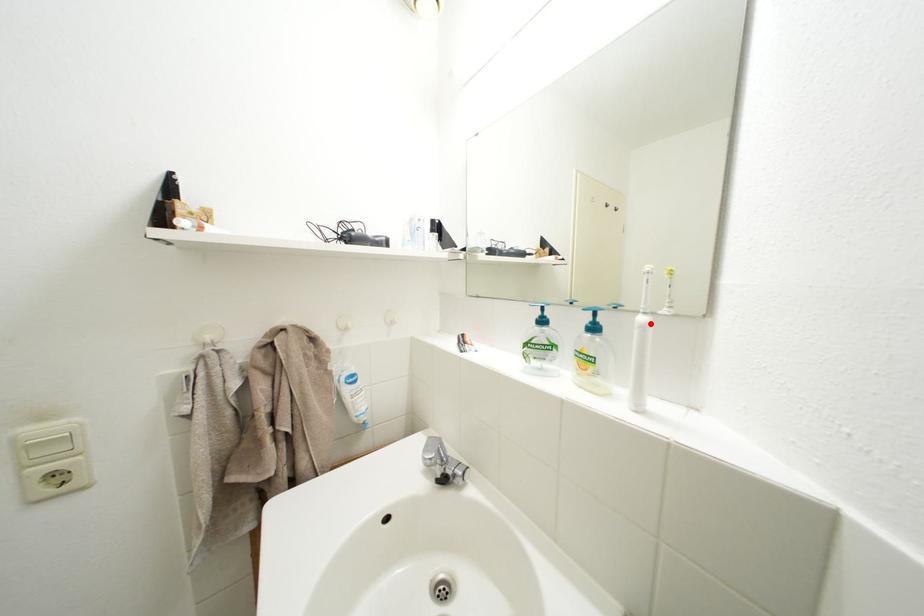
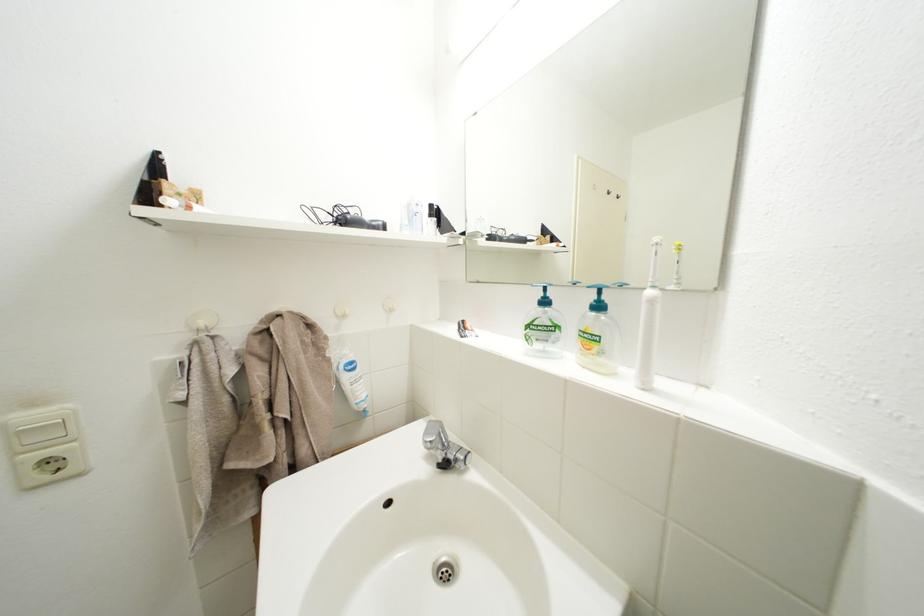
In the second image, find the point that corresponds to the highlighted location in the first image.

(659, 298)